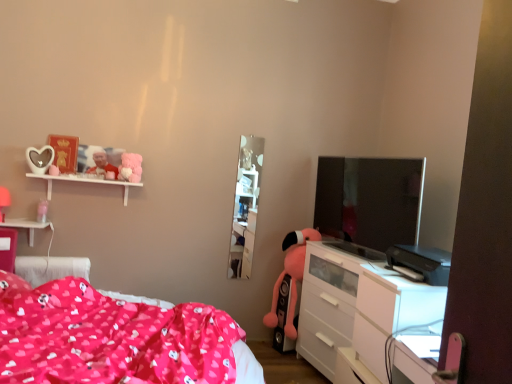
Question: In which direction should I rotate to look at pink plush toy at lower center, the first toy positioned from the right?

Choices:
 (A) right
 (B) left

Answer: (A)

Question: Can you confirm if silver glossy tv at right is smaller than white matte shelf at upper left?

Choices:
 (A) yes
 (B) no

Answer: (B)

Question: Is silver glossy tv at right facing towards white matte shelf at upper left?

Choices:
 (A) no
 (B) yes

Answer: (B)

Question: From the image's perspective, is silver glossy tv at right beneath white matte shelf at upper left?

Choices:
 (A) yes
 (B) no

Answer: (A)

Question: Is silver glossy tv at right in front of white matte shelf at upper left?

Choices:
 (A) no
 (B) yes

Answer: (B)

Question: From the image's perspective, is silver glossy tv at right above white matte shelf at upper left?

Choices:
 (A) no
 (B) yes

Answer: (A)

Question: Is silver glossy tv at right positioned with its back to white matte shelf at upper left?

Choices:
 (A) no
 (B) yes

Answer: (A)

Question: Is white matte shelf at upper left not near matte plastic photo frame at upper left, placed as the third toy when sorted from right to left?

Choices:
 (A) no
 (B) yes

Answer: (A)

Question: Is white matte shelf at upper left shorter than matte plastic photo frame at upper left, placed as the third toy when sorted from right to left?

Choices:
 (A) yes
 (B) no

Answer: (A)

Question: From the image's perspective, is white matte shelf at upper left below matte plastic photo frame at upper left, which is counted as the third toy, starting from the bottom?

Choices:
 (A) yes
 (B) no

Answer: (A)

Question: From a real-world perspective, is white matte shelf at upper left under matte plastic photo frame at upper left, which is counted as the third toy, starting from the bottom?

Choices:
 (A) no
 (B) yes

Answer: (B)

Question: From a real-world perspective, is white matte shelf at upper left on matte plastic photo frame at upper left, the first toy when ordered from left to right?

Choices:
 (A) yes
 (B) no

Answer: (B)

Question: Is white matte shelf at upper left located outside matte plastic photo frame at upper left, placed as the third toy when sorted from right to left?

Choices:
 (A) no
 (B) yes

Answer: (B)

Question: From a real-world perspective, is fluffy pink plush at upper left, the second toy positioned from the right, located beneath matte plastic photo frame at upper left, which is counted as the third toy, starting from the bottom?

Choices:
 (A) yes
 (B) no

Answer: (A)